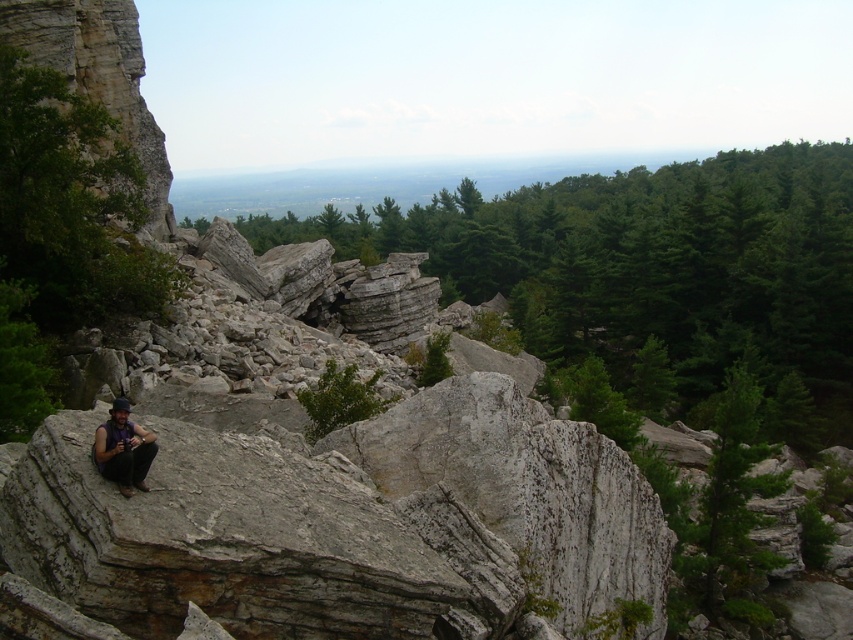
Question: Which point appears farthest from the camera in this image?

Choices:
 (A) (305, 388)
 (B) (706, 497)
 (C) (717, 385)

Answer: (C)

Question: Is green leafy tree at center smaller than green leafy shrub at center?

Choices:
 (A) no
 (B) yes

Answer: (A)

Question: Which object is farther from the camera taking this photo?

Choices:
 (A) green matte tree at right
 (B) green leafy tree at center
 (C) green leafy shrub at center
 (D) matte black shirt at lower left

Answer: (B)

Question: Estimate the real-world distances between objects in this image. Which object is closer to the green matte tree at right?

Choices:
 (A) green leafy shrub at center
 (B) matte black shirt at lower left
 (C) green leafy tree at center

Answer: (A)

Question: Can you confirm if green leafy tree at center is positioned to the right of green leafy shrub at center?

Choices:
 (A) no
 (B) yes

Answer: (B)

Question: Is green matte tree at right positioned behind matte black shirt at lower left?

Choices:
 (A) no
 (B) yes

Answer: (B)